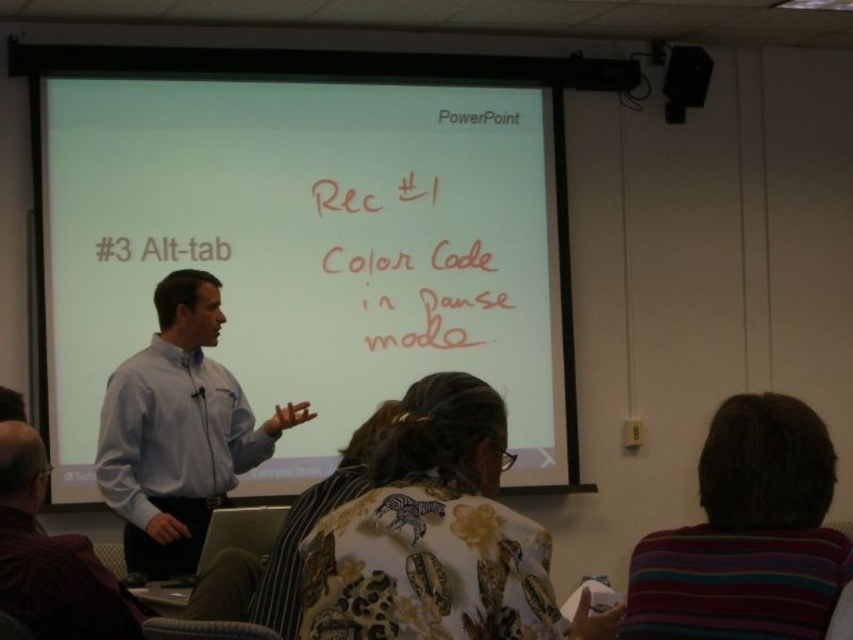
Who is more forward, (503, 432) or (492, 291)?

Point (503, 432) is more forward.

Who is more distant from viewer, (x=453, y=385) or (x=427, y=289)?

The point (x=427, y=289) is more distant.

Where is `floral fabric shirt at center`? The width and height of the screenshot is (853, 640). floral fabric shirt at center is located at coordinates (436, 536).

Where is `floral fabric shirt at center`? floral fabric shirt at center is located at coordinates (436, 536).

Is white matte projector screen at upper center positioned behind matte blue shirt at center?

Yes.

Which is more to the left, white matte projector screen at upper center or matte blue shirt at center?

From the viewer's perspective, matte blue shirt at center appears more on the left side.

Is point (428, 88) positioned in front of point (48, 593)?

No, it is behind (48, 593).

Locate an element on the screen. white matte projector screen at upper center is located at coordinates (x=306, y=248).

Which of these two, white matte projector screen at upper center or floral fabric shirt at center, stands shorter?

With less height is floral fabric shirt at center.

Describe the element at coordinates (306, 248) in the screenshot. I see `white matte projector screen at upper center` at that location.

Which is behind, point (178, 134) or point (479, 420)?

The point (178, 134) is behind.

The image size is (853, 640). What are the coordinates of `white matte projector screen at upper center` in the screenshot? It's located at (306, 248).